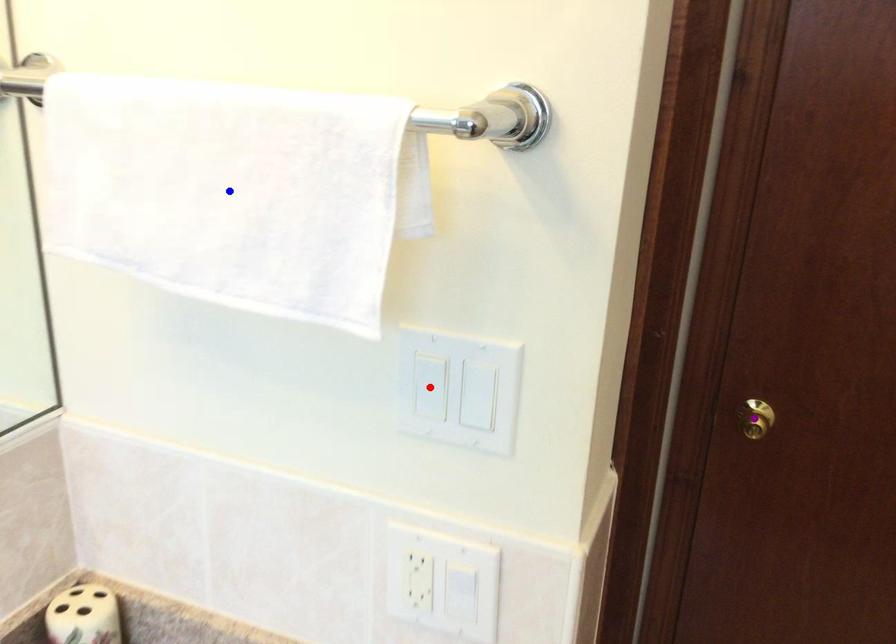
Order these from nearest to farthest:
purple point, blue point, red point

blue point
red point
purple point